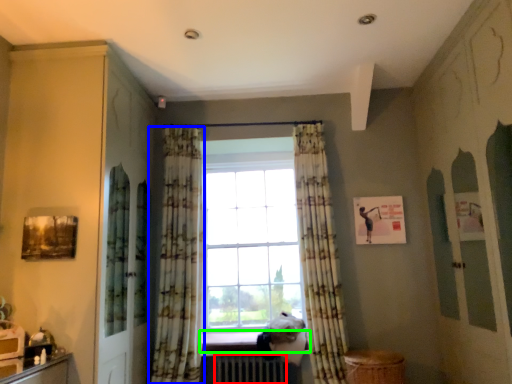
Question: Which object is positioned closest to radiator (highlighted by a red box)? Select from curtain (highlighted by a blue box) and window sill (highlighted by a green box).

Choices:
 (A) curtain
 (B) window sill

Answer: (B)